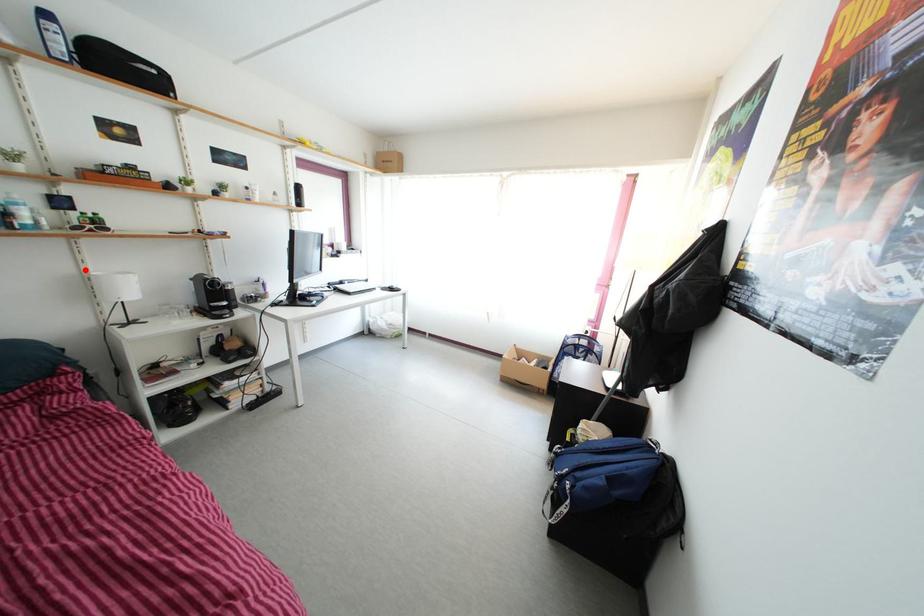
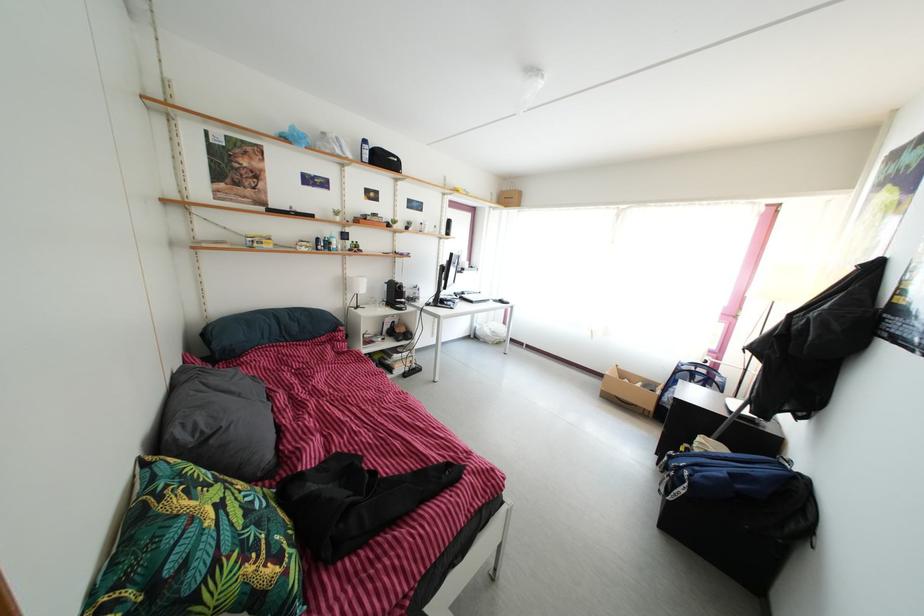
In the second image, find the point that corresponds to the highlighted location in the first image.

(350, 277)